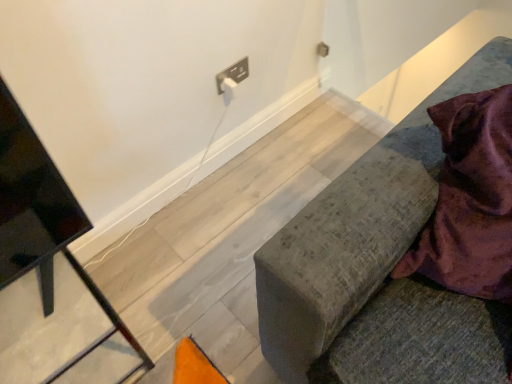
Question: Is point (321, 347) closer or farther from the camera than point (476, 283)?

Choices:
 (A) closer
 (B) farther

Answer: (A)

Question: From the image's perspective, is velvet grey cushion at right, marked as the first furniture in a right-to-left arrangement, positioned above or below velvet purple blanket at right?

Choices:
 (A) below
 (B) above

Answer: (A)

Question: Estimate the real-world distances between objects in this image. Which object is farther from the velvet grey cushion at right, which is the 2th furniture from left to right?

Choices:
 (A) black metal tv stand at left, acting as the 1th furniture starting from the left
 (B) velvet purple blanket at right

Answer: (A)

Question: Which is nearer to the velvet grey cushion at right, which is the 2th furniture from left to right?

Choices:
 (A) velvet purple blanket at right
 (B) black metal tv stand at left, acting as the 1th furniture starting from the left

Answer: (A)